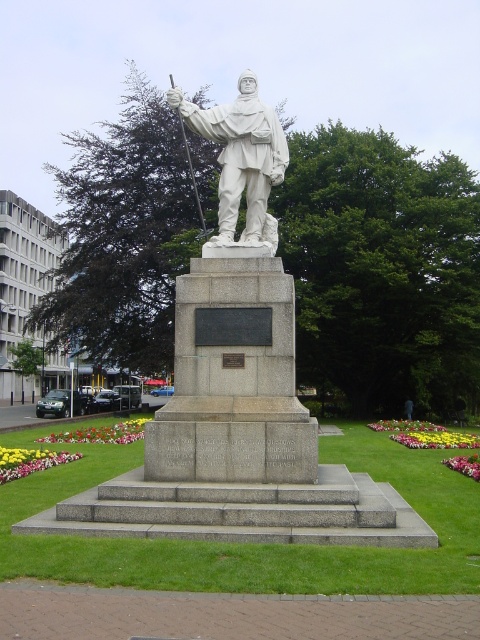
You are standing in the public square and want to approach the white marble statue at center. There are gray stone steps at center nearby. From the statue, which direction should you walk to reach the steps?

To reach the gray stone steps at center from the white marble statue at center, you should walk to the left since the steps are to the right of the statue, so the opposite direction would be left.

You are a maintenance worker needing to clean the statue at the top of the gray stone steps at center. You have a ladder that is 5 meters long. Can you reach the statue without moving the ladder closer to the steps?

The gray stone steps at center and viewer are 5.98 meters apart from each other. Since the ladder is only 5 meters long, it is shorter than the distance between you and the steps. Therefore, you cannot reach the statue without moving the ladder closer.